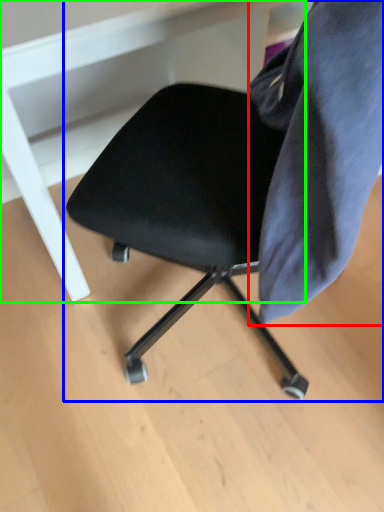
Question: Based on their relative distances, which object is farther from fabric (highlighted by a red box)? Choose from chair (highlighted by a blue box) and vanity (highlighted by a green box).

Choices:
 (A) chair
 (B) vanity

Answer: (B)